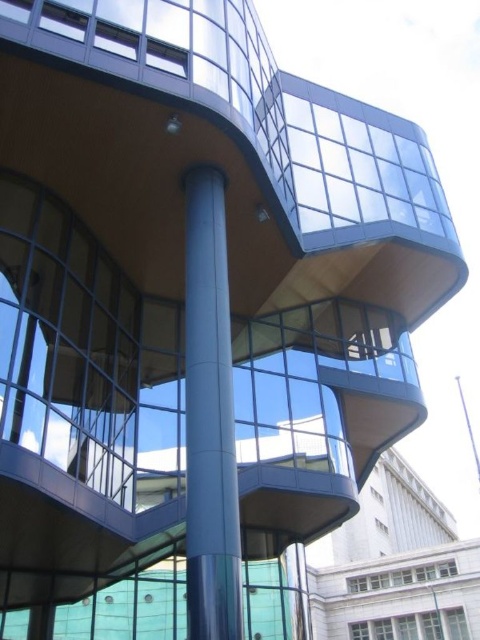
Question: Is satin silver column at center closer to camera compared to blue metallic pole at center?

Choices:
 (A) yes
 (B) no

Answer: (A)

Question: Does satin silver column at center lie behind blue metallic pole at center?

Choices:
 (A) yes
 (B) no

Answer: (B)

Question: Which point is farther to the camera?

Choices:
 (A) blue metallic pole at center
 (B) satin silver column at center

Answer: (A)

Question: Which point is farther from the camera taking this photo?

Choices:
 (A) (476, 449)
 (B) (210, 449)

Answer: (A)

Question: Which of the following is the closest to the observer?

Choices:
 (A) blue metallic pole at center
 (B) satin silver column at center

Answer: (B)

Question: Can you confirm if satin silver column at center is positioned above blue metallic pole at center?

Choices:
 (A) no
 (B) yes

Answer: (B)